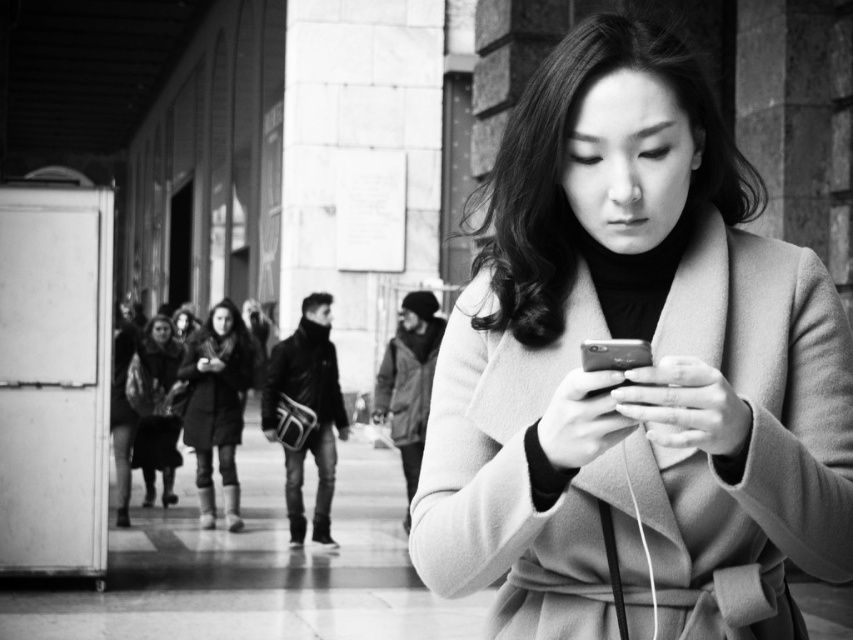
Question: Which object is positioned farthest from the leather jacket at center?

Choices:
 (A) black glossy smartphone at center
 (B) coated leather jacket at center
 (C) shiny metallic purse at center
 (D) velvet-like brown coat at center

Answer: (A)

Question: Which point appears closest to the camera in this image?

Choices:
 (A) (204, 424)
 (B) (402, 378)
 (C) (149, 493)
 (D) (822, 374)

Answer: (D)

Question: Is dark woolen coat at center wider than black glossy smartphone at center?

Choices:
 (A) yes
 (B) no

Answer: (A)

Question: Does smooth beige coat at center appear under black glossy smartphone at center?

Choices:
 (A) no
 (B) yes

Answer: (B)

Question: Is coated leather jacket at center to the left of shiny metallic purse at center from the viewer's perspective?

Choices:
 (A) yes
 (B) no

Answer: (B)

Question: Which point appears closest to the camera in this image?

Choices:
 (A) (596, 349)
 (B) (155, 342)

Answer: (A)